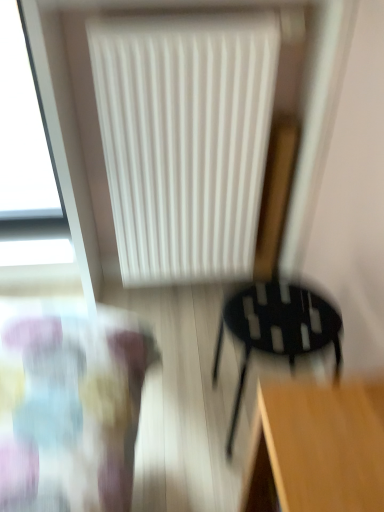
Question: From the image's perspective, is white matte radiator at upper center located above or below black matte chair at lower right?

Choices:
 (A) below
 (B) above

Answer: (B)

Question: From a real-world perspective, is white matte radiator at upper center physically located above or below black matte chair at lower right?

Choices:
 (A) above
 (B) below

Answer: (A)

Question: Does point (187, 105) appear closer or farther from the camera than point (266, 307)?

Choices:
 (A) closer
 (B) farther

Answer: (B)

Question: Does point (316, 322) appear closer or farther from the camera than point (192, 22)?

Choices:
 (A) closer
 (B) farther

Answer: (A)

Question: In the image, is black matte chair at lower right on the left side or the right side of white matte radiator at upper center?

Choices:
 (A) left
 (B) right

Answer: (B)

Question: In the image, is black matte chair at lower right positioned in front of or behind white matte radiator at upper center?

Choices:
 (A) front
 (B) behind

Answer: (A)

Question: From the image's perspective, is black matte chair at lower right located above or below white matte radiator at upper center?

Choices:
 (A) below
 (B) above

Answer: (A)